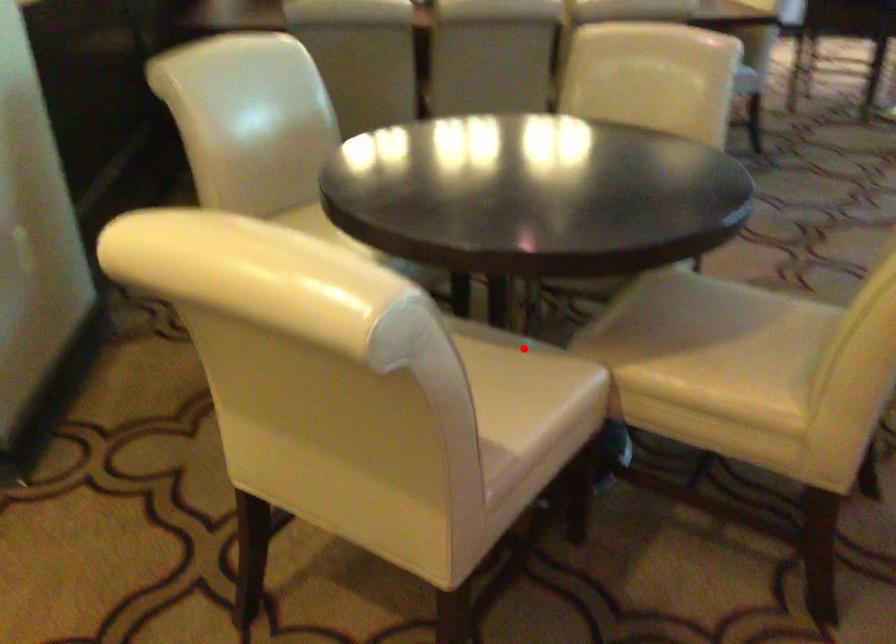
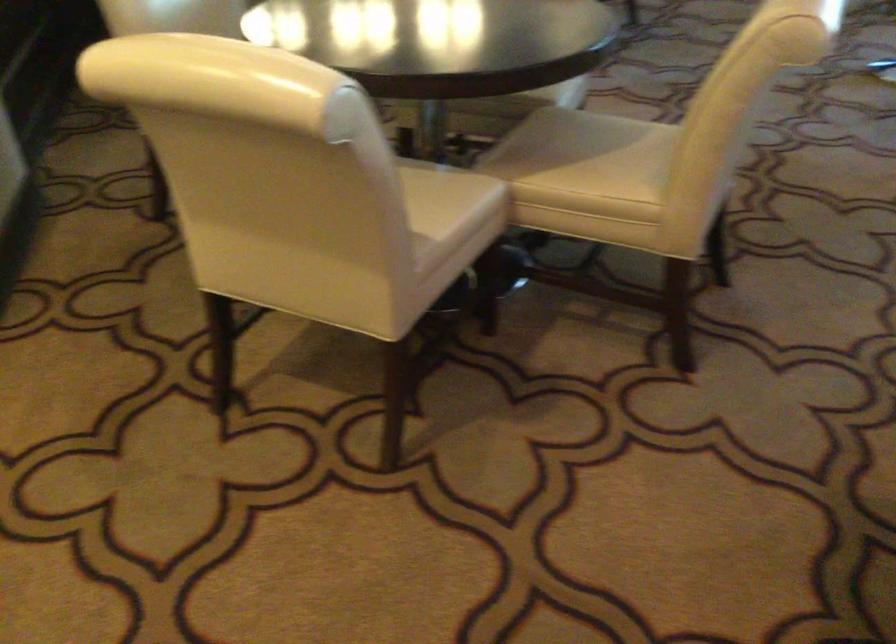
Locate, in the second image, the point that corresponds to the highlighted location in the first image.

(437, 167)